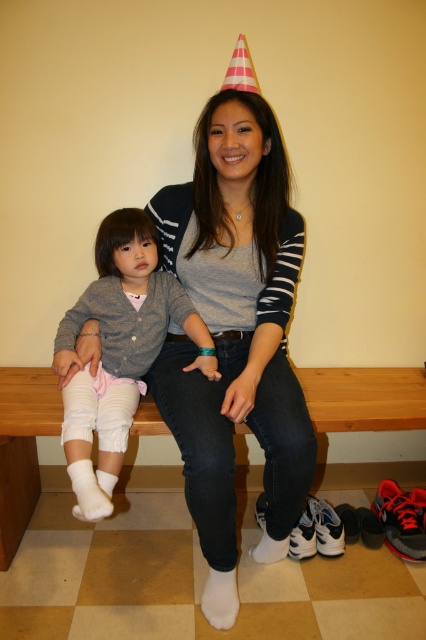
Can you confirm if matte gray sweater at center is wider than white fluffy socks at left?

Incorrect, matte gray sweater at center's width does not surpass white fluffy socks at left's.

Which of these two, matte gray sweater at center or white fluffy socks at left, stands taller?

Standing taller between the two is matte gray sweater at center.

Between point (167, 195) and point (131, 234), which one is positioned in front?

Point (131, 234)

Identify the location of matte gray sweater at center. (235, 333).